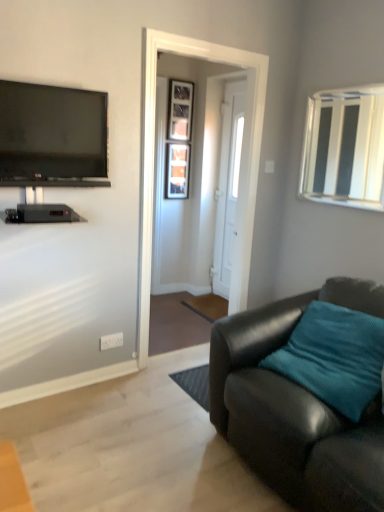
Question: Should I look upward or downward to see white glossy door at center?

Choices:
 (A) down
 (B) up

Answer: (B)

Question: From a real-world perspective, does wooden frame at center, marked as the second window in a right-to-left arrangement, sit lower than flat screen tv at upper left?

Choices:
 (A) yes
 (B) no

Answer: (A)

Question: Is wooden frame at center, placed as the first window when sorted from left to right, in front of flat screen tv at upper left?

Choices:
 (A) yes
 (B) no

Answer: (B)

Question: Is the depth of wooden frame at center, marked as the second window in a right-to-left arrangement, greater than that of flat screen tv at upper left?

Choices:
 (A) no
 (B) yes

Answer: (B)

Question: Is wooden frame at center, which is counted as the 2th window, starting from the front, oriented towards flat screen tv at upper left?

Choices:
 (A) yes
 (B) no

Answer: (B)

Question: From a real-world perspective, is wooden frame at center, placed as the first window when sorted from left to right, positioned over flat screen tv at upper left based on gravity?

Choices:
 (A) yes
 (B) no

Answer: (B)

Question: Does wooden frame at center, placed as the first window when sorted from left to right, have a lesser height compared to flat screen tv at upper left?

Choices:
 (A) no
 (B) yes

Answer: (A)

Question: From the image's perspective, would you say white glossy door at center is positioned over wooden frame at center, marked as the second window in a right-to-left arrangement?

Choices:
 (A) no
 (B) yes

Answer: (A)

Question: Is white glossy door at center to the right of wooden frame at center, marked as the second window in a right-to-left arrangement, from the viewer's perspective?

Choices:
 (A) no
 (B) yes

Answer: (B)

Question: From a real-world perspective, does white glossy door at center stand above wooden frame at center, arranged as the first window when viewed from the back?

Choices:
 (A) yes
 (B) no

Answer: (B)

Question: Considering the relative sizes of white glossy door at center and wooden frame at center, which is counted as the 2th window, starting from the front, in the image provided, is white glossy door at center smaller than wooden frame at center, which is counted as the 2th window, starting from the front,?

Choices:
 (A) no
 (B) yes

Answer: (A)

Question: Considering the relative sizes of white glossy door at center and wooden frame at center, which is counted as the 2th window, starting from the front, in the image provided, is white glossy door at center taller than wooden frame at center, which is counted as the 2th window, starting from the front,?

Choices:
 (A) yes
 (B) no

Answer: (A)

Question: Does white glossy door at center touch wooden frame at center, arranged as the first window when viewed from the back?

Choices:
 (A) yes
 (B) no

Answer: (B)

Question: Is white glossy door at center oriented away from white plastic power outlet at lower center?

Choices:
 (A) yes
 (B) no

Answer: (B)